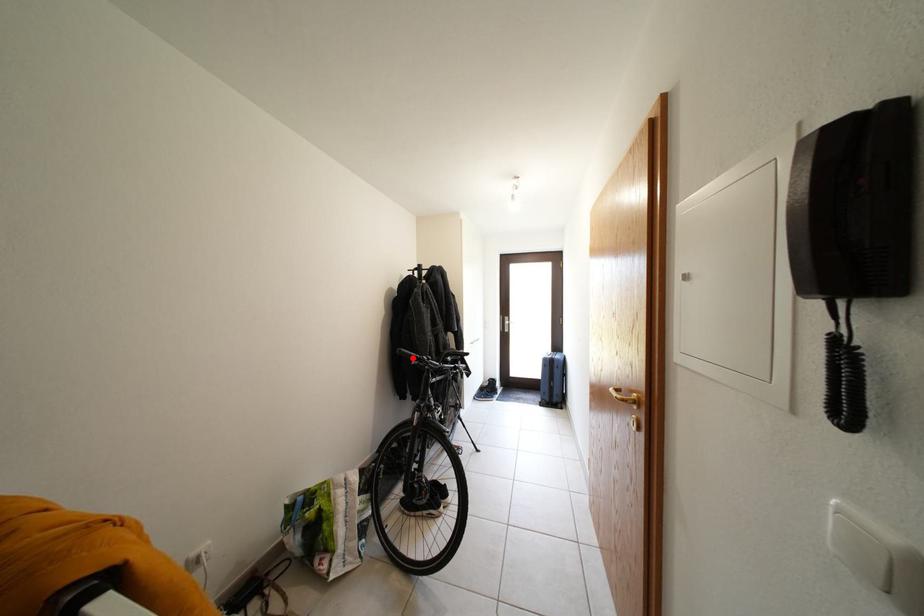
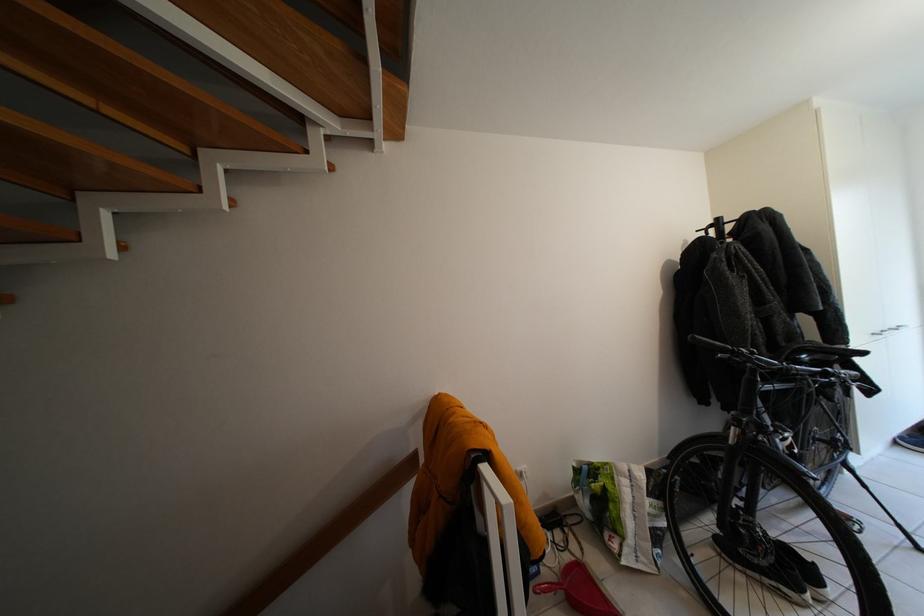
Find the pixel in the second image that matches the highlighted location in the first image.

(710, 345)